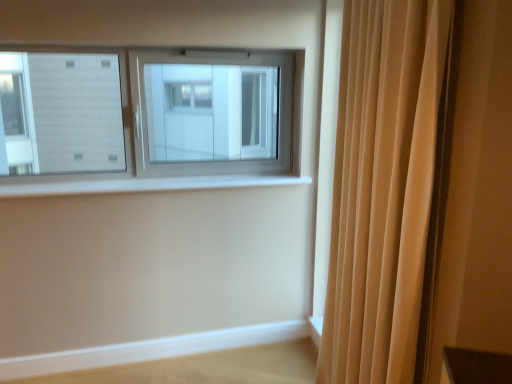
Where is `free point above light wood ledge at lower right (from a real-world perspective)`? This screenshot has height=384, width=512. free point above light wood ledge at lower right (from a real-world perspective) is located at coordinates (201, 332).